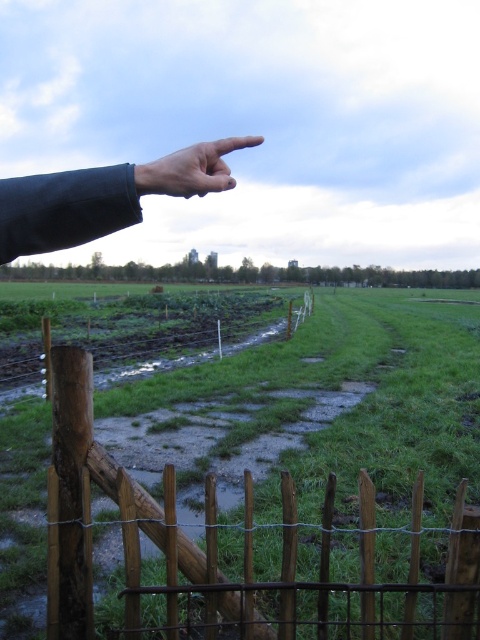
Does dark skin hand at upper left have a lesser height compared to smooth skin hand at upper left?

Indeed, dark skin hand at upper left has a lesser height compared to smooth skin hand at upper left.

Which is more to the right, dark skin hand at upper left or smooth skin hand at upper left?

Positioned to the right is dark skin hand at upper left.

Is point (39, 180) farther from camera compared to point (204, 150)?

No.

In order to click on dark skin hand at upper left in this screenshot , I will do `click(104, 196)`.

Is point (315, 333) more distant than point (135, 188)?

That is True.

What do you see at coordinates (350, 410) in the screenshot? I see `green grassy field at center` at bounding box center [350, 410].

In order to click on green grassy field at center in this screenshot , I will do `click(350, 410)`.

Can you confirm if green grassy field at center is shorter than dark skin hand at upper left?

No, green grassy field at center is not shorter than dark skin hand at upper left.

Is point (424, 552) positioned after point (74, 220)?

Yes, it is behind point (74, 220).

Find the location of a particular element. The image size is (480, 640). green grassy field at center is located at coordinates (350, 410).